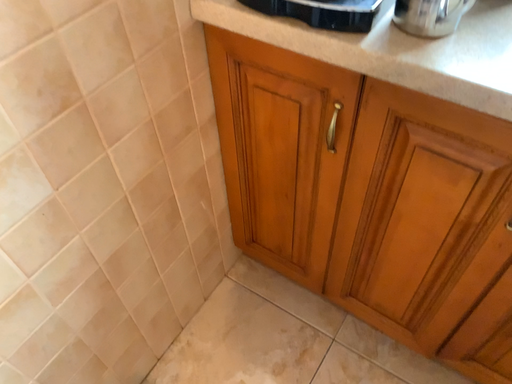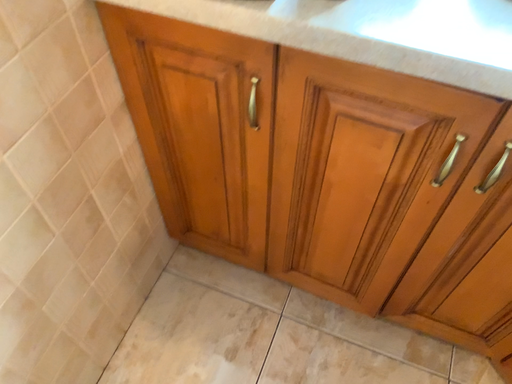
Question: Which way did the camera rotate in the video?

Choices:
 (A) rotated right
 (B) rotated left

Answer: (A)